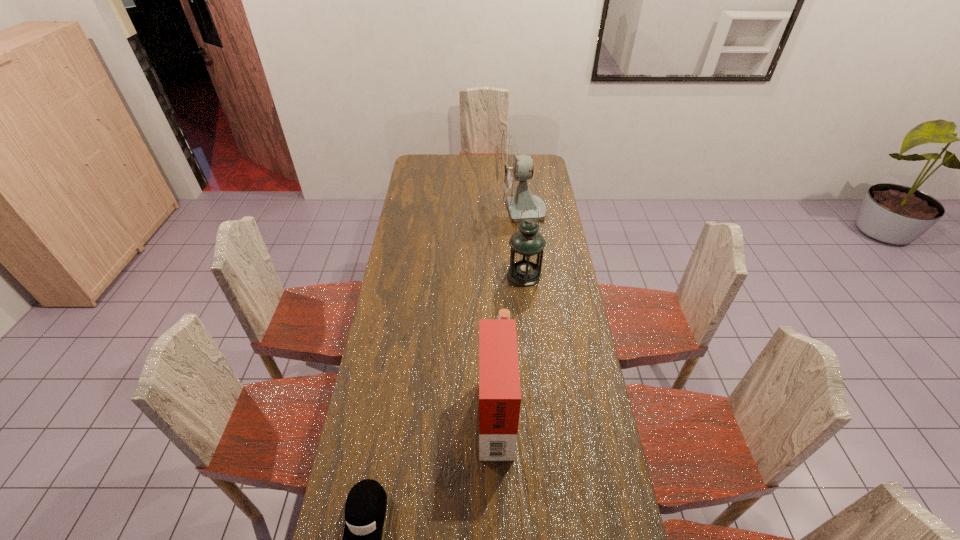
I want to click on the tallest object, so click(x=512, y=171).

Identify the location of fan. The width and height of the screenshot is (960, 540). (512, 171).

Identify the location of the third nearest object. (527, 244).

Locate an element on the screen. The height and width of the screenshot is (540, 960). the third farthest object is located at coordinates (499, 380).

I want to click on vacant region located 0.260m in front of the farthest object to blow air, so click(444, 212).

Find the location of a particular element. The image size is (960, 540). free space located in front of the farthest object to blow air is located at coordinates (483, 212).

In order to click on free spot located 0.070m in front of the farthest object to blow air in this screenshot , I will do `click(481, 212)`.

Image resolution: width=960 pixels, height=540 pixels. In order to click on vacant region located 0.150m on the left of the second farthest object in this screenshot , I will do `click(472, 275)`.

At what (x,y) coordinates should I click in order to perform the action: click on vacant area situated on the front-facing side of the third farthest object. Please return your answer as a coordinate pair (x, y). The image size is (960, 540). Looking at the image, I should click on (391, 411).

You are a GUI agent. You are given a task and a screenshot of the screen. Output one action in this format:
    pyautogui.click(x=<x>, y=<y>)
    Task: Click on the blank space located on the front-facing side of the third farthest object
    This screenshot has width=960, height=540.
    Given the screenshot: What is the action you would take?
    pyautogui.click(x=437, y=411)